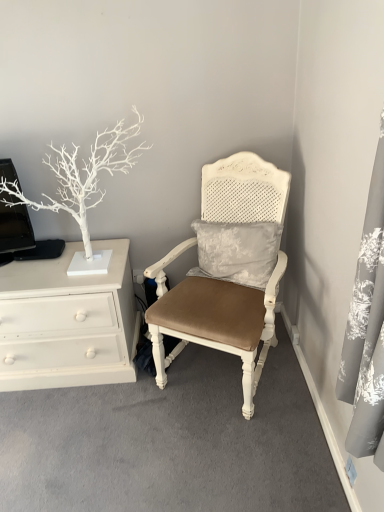
You are a GUI agent. You are given a task and a screenshot of the screen. Output one action in this format:
    pyautogui.click(x=<x>, y=<y>)
    Task: Click on the free spot in front of white painted wood chest of drawers at left
    Image resolution: width=384 pixels, height=512 pixels.
    Given the screenshot: What is the action you would take?
    pyautogui.click(x=71, y=434)